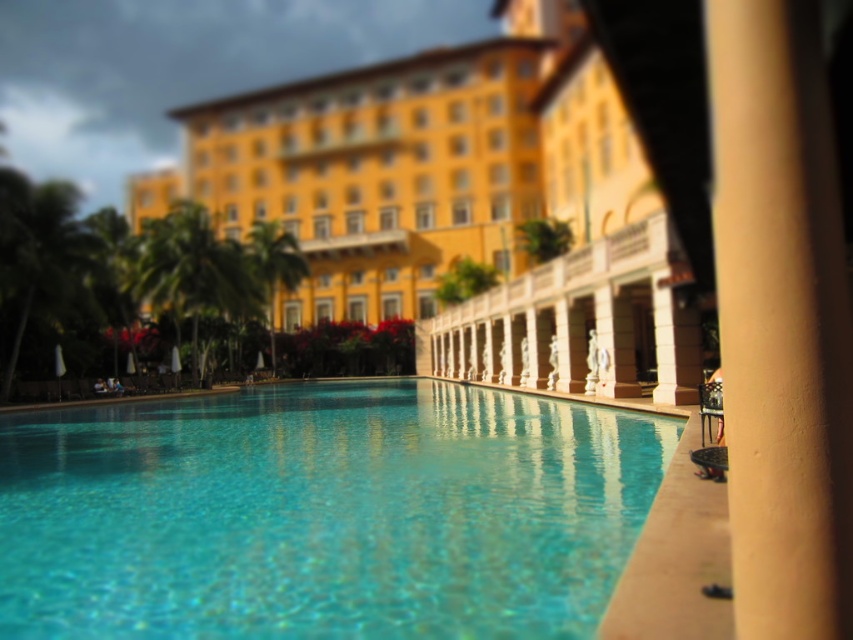
You are standing at the edge of the swimming pool and notice a point marked at coordinates (190, 264). Based on the scene description, can you identify what this point is located on?

The point at coordinates (190, 264) is located on the green leafy palm tree at left.

You are a guest staying at the resort and want to take a photo of the yellow matte building at center with the beige smooth pillar at center in the foreground. Is this possible given their positions?

The beige smooth pillar at center is behind the yellow matte building at center, so you cannot have the beige smooth pillar at center in the foreground of the yellow matte building at center in your photo.